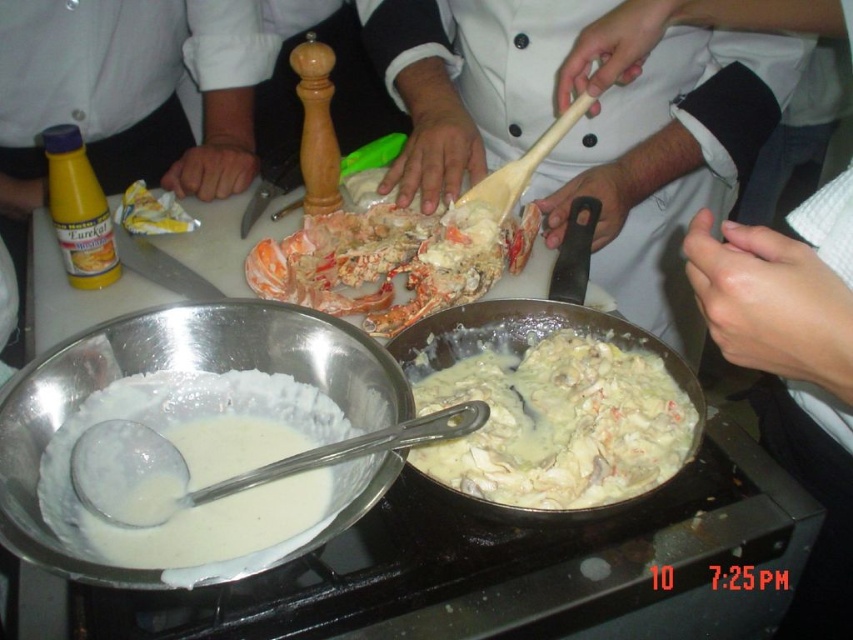
You are standing in the kitchen and want to reach the point at coordinates point (689, 168). If your arm can extend 0.9 meters, can you reach it?

The distance between you and point (689, 168) is 1.04 meters, which is slightly longer than your arm can reach. You cannot reach it with your current arm extension.

You are a chef in the kitchen preparing a dish. You need to reach the point marked at coordinates [532,346]. Considering your arm can extend 30 inches, will you be able to reach that point from your current position?

The distance between you and the point marked at coordinates [532,346] is 31.96 inches. Since your arm can only extend 30 inches, you will not be able to reach it.